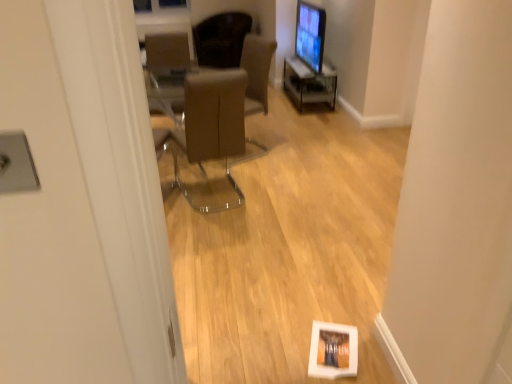
Question: Is brown leather chair at center, the third chair positioned from the top, wider or thinner than dark brown leather chair at upper center, the third chair when ordered from front to back?

Choices:
 (A) wide
 (B) thin

Answer: (B)

Question: Considering the positions of brown leather chair at center, the third chair positioned from the back, and dark brown leather chair at upper center, the third chair when ordered from front to back, in the image, is brown leather chair at center, the third chair positioned from the back, taller or shorter than dark brown leather chair at upper center, the third chair when ordered from front to back,?

Choices:
 (A) short
 (B) tall

Answer: (B)

Question: Which of these objects is positioned farthest from the brown leather chair at center, the third chair positioned from the top?

Choices:
 (A) brown leather chair at center, the 2th chair when ordered from bottom to top
 (B) dark brown leather chair at upper center, the third chair when ordered from front to back
 (C) matte black monitor at upper right

Answer: (C)

Question: Considering the real-world distances, which object is farthest from the dark brown leather chair at upper center, the third chair when ordered from front to back?

Choices:
 (A) brown leather chair at center, the 2th chair when ordered from bottom to top
 (B) matte black monitor at upper right
 (C) brown leather chair at center, the third chair positioned from the back

Answer: (B)